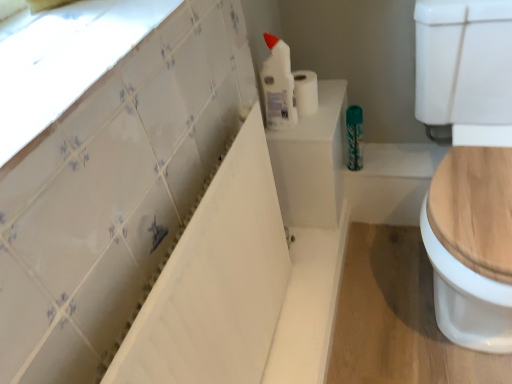
Question: Is white glossy bathtub at upper left located outside white glossy tile at upper left?

Choices:
 (A) no
 (B) yes

Answer: (B)

Question: Does white glossy bathtub at upper left have a greater height compared to white glossy tile at upper left?

Choices:
 (A) yes
 (B) no

Answer: (A)

Question: Are white glossy bathtub at upper left and white glossy tile at upper left making contact?

Choices:
 (A) yes
 (B) no

Answer: (B)

Question: Can you confirm if white glossy bathtub at upper left is smaller than white glossy tile at upper left?

Choices:
 (A) yes
 (B) no

Answer: (B)

Question: Is the depth of white glossy bathtub at upper left less than that of white glossy tile at upper left?

Choices:
 (A) no
 (B) yes

Answer: (A)

Question: Is white glossy bottle at upper center in front of or behind white matte toilet paper at upper center in the image?

Choices:
 (A) front
 (B) behind

Answer: (A)

Question: Is point (291, 94) positioned closer to the camera than point (300, 94)?

Choices:
 (A) closer
 (B) farther

Answer: (A)

Question: From a real-world perspective, is white glossy bottle at upper center positioned above or below white matte toilet paper at upper center?

Choices:
 (A) below
 (B) above

Answer: (B)

Question: Is white glossy bottle at upper center taller or shorter than white matte toilet paper at upper center?

Choices:
 (A) tall
 (B) short

Answer: (A)

Question: Based on their sizes in the image, would you say white glossy tile at upper left is bigger or smaller than white glossy bathtub at upper left?

Choices:
 (A) big
 (B) small

Answer: (B)

Question: Is white glossy tile at upper left to the left or to the right of white glossy bathtub at upper left in the image?

Choices:
 (A) left
 (B) right

Answer: (A)

Question: Is white glossy tile at upper left in front of or behind white glossy bathtub at upper left in the image?

Choices:
 (A) behind
 (B) front

Answer: (B)

Question: From the image's perspective, is white glossy tile at upper left positioned above or below white glossy bathtub at upper left?

Choices:
 (A) below
 (B) above

Answer: (B)

Question: Would you say teal metallic can at center is to the left or to the right of white glossy bathtub at upper left in the picture?

Choices:
 (A) left
 (B) right

Answer: (B)

Question: From a real-world perspective, is teal metallic can at center positioned above or below white glossy bathtub at upper left?

Choices:
 (A) below
 (B) above

Answer: (A)